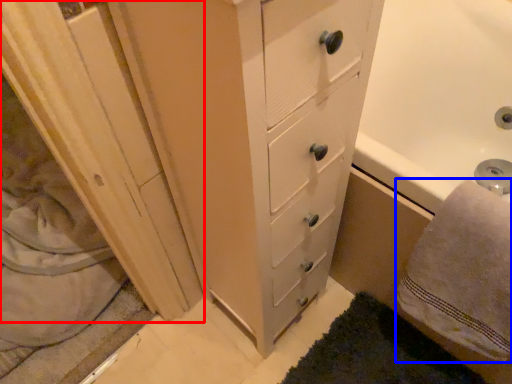
Question: Which object appears farthest to the camera in this image, screen door (highlighted by a red box) or bath towel (highlighted by a blue box)?

Choices:
 (A) screen door
 (B) bath towel

Answer: (A)